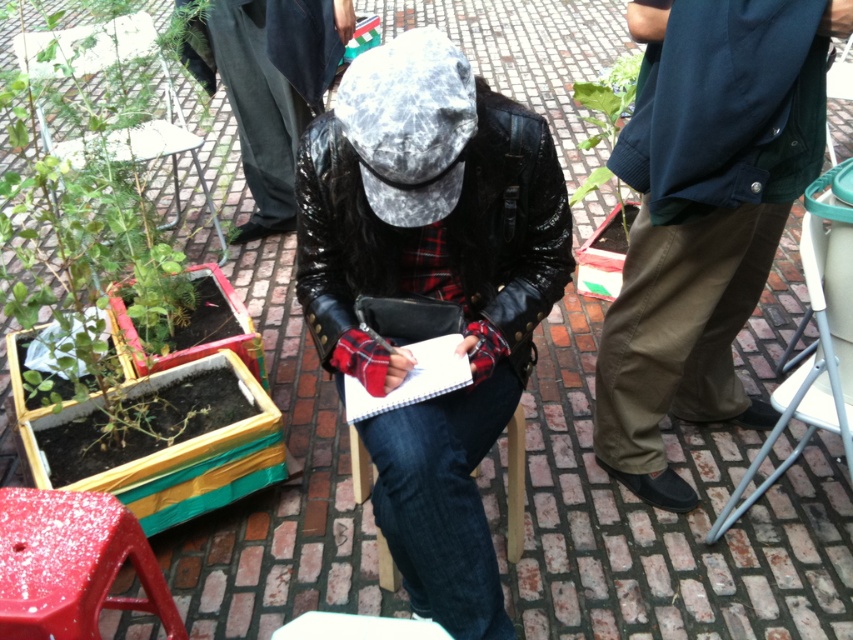
Does leather jacket at center lie in front of white paper at center?

Yes.

Image resolution: width=853 pixels, height=640 pixels. In order to click on leather jacket at center in this screenshot , I will do `click(432, 291)`.

Where is `leather jacket at center`? leather jacket at center is located at coordinates (432, 291).

Does metallic silver chair at right appear over white paper at center?

No, metallic silver chair at right is not above white paper at center.

Is metallic silver chair at right closer to the viewer compared to white paper at center?

No, it is not.

Between point (833, 230) and point (451, 352), which one is positioned in front?

Point (451, 352) is in front.

Where is `metallic silver chair at right`? Image resolution: width=853 pixels, height=640 pixels. metallic silver chair at right is located at coordinates (810, 362).

Which is more to the left, white paper at center or green leafy plant at upper right?

Positioned to the left is white paper at center.

Is white paper at center above green leafy plant at upper right?

No.

Who is more forward, (355, 406) or (610, 120)?

Point (355, 406) is more forward.

Image resolution: width=853 pixels, height=640 pixels. Identify the location of white paper at center. (412, 380).